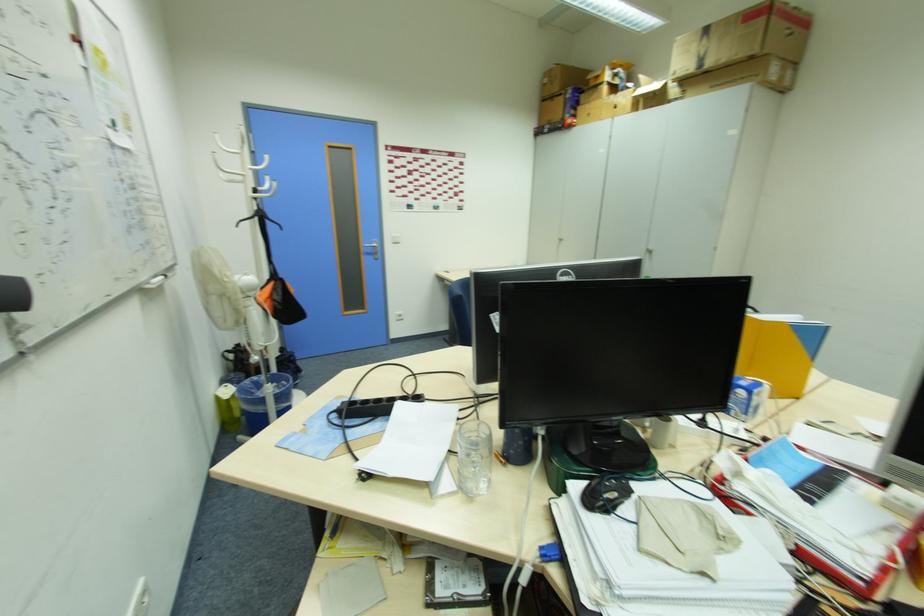
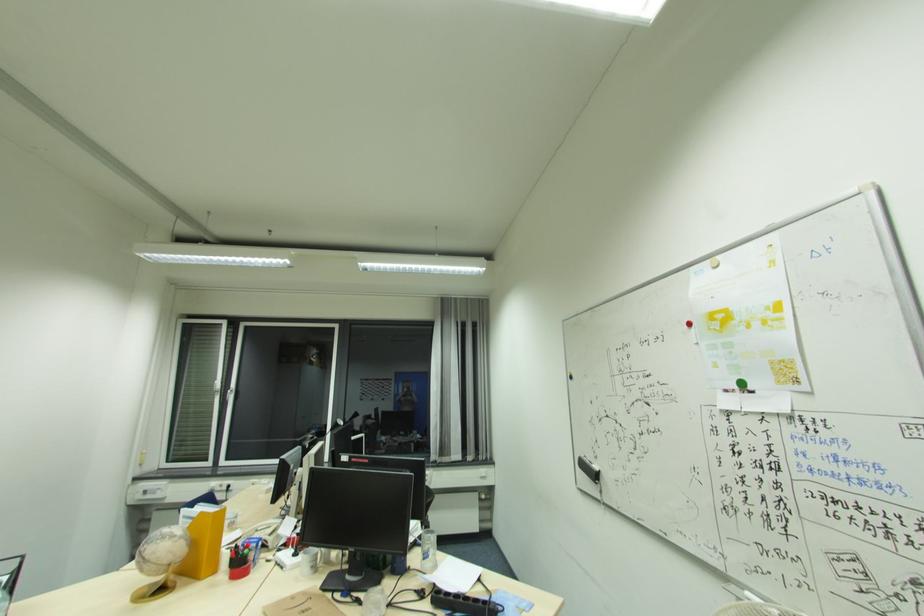
Find the pixel in the second image that matches point 116,126 in the first image.

(739, 387)